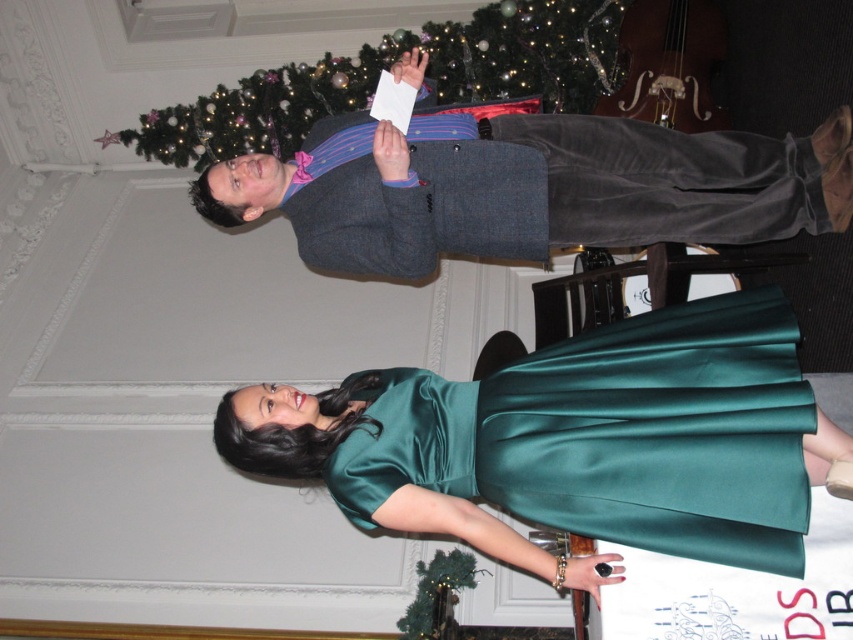
Is green textured christmas tree at upper center closer to camera compared to green matte christmas tree at center?

No, green textured christmas tree at upper center is further to the viewer.

Which is more to the right, green textured christmas tree at upper center or green matte christmas tree at center?

Positioned to the right is green matte christmas tree at center.

Is point (219, 106) farther from camera compared to point (474, 582)?

Yes.

I want to click on green textured christmas tree at upper center, so click(x=387, y=67).

Does emerald satin dress at center have a lesser width compared to green matte christmas tree at center?

In fact, emerald satin dress at center might be wider than green matte christmas tree at center.

Does emerald satin dress at center appear on the right side of green matte christmas tree at center?

Correct, you'll find emerald satin dress at center to the right of green matte christmas tree at center.

The width and height of the screenshot is (853, 640). What do you see at coordinates (572, 440) in the screenshot?
I see `emerald satin dress at center` at bounding box center [572, 440].

What are the coordinates of `emerald satin dress at center` in the screenshot? It's located at (572, 440).

Can you confirm if matte gray suit at center is shorter than green textured christmas tree at upper center?

Indeed, matte gray suit at center has a lesser height compared to green textured christmas tree at upper center.

Can you confirm if matte gray suit at center is positioned below green textured christmas tree at upper center?

Yes.

Does point (567, 145) lie in front of point (148, 118)?

Yes, point (567, 145) is closer to viewer.

Locate an element on the screen. matte gray suit at center is located at coordinates (541, 192).